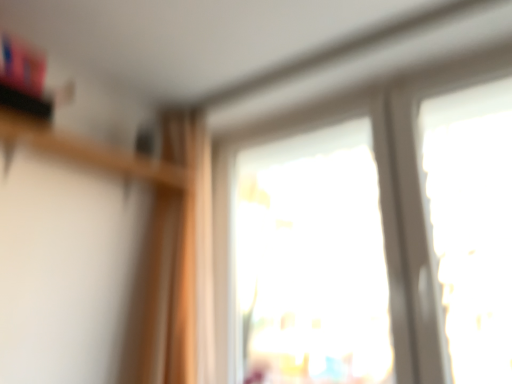
The height and width of the screenshot is (384, 512). What do you see at coordinates (371, 235) in the screenshot?
I see `transparent glass window at center` at bounding box center [371, 235].

Locate an element on the screen. The height and width of the screenshot is (384, 512). transparent glass window at center is located at coordinates (371, 235).

At what (x,y) coordinates should I click in order to perform the action: click on transparent glass window at center. Please return your answer as a coordinate pair (x, y). This screenshot has height=384, width=512. Looking at the image, I should click on (371, 235).